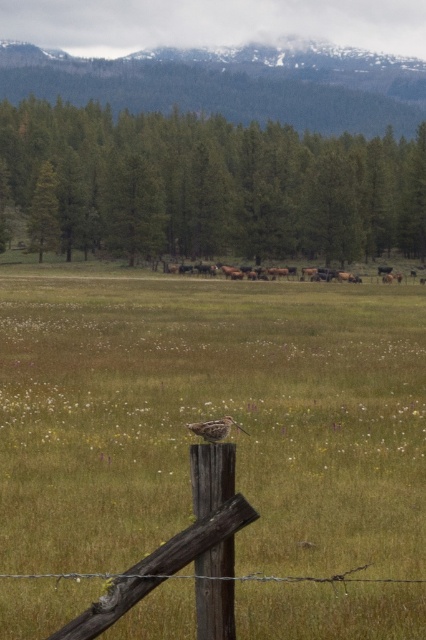
You are a photographer trying to capture a clear photo of the brown speckled bird at center and the brown furry cows at center. Which one will appear closer to the camera in the photo?

The brown furry cows at center will appear closer to the camera because the brown speckled bird at center is behind them.